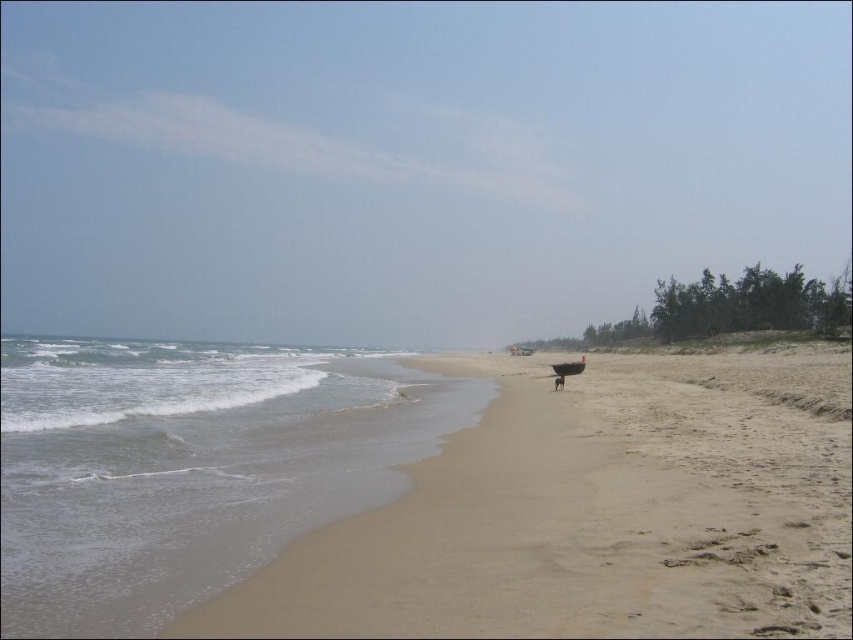
Consider the image. Can you confirm if light beige sand at lower left is smaller than gray sand at lower left?

Correct, light beige sand at lower left occupies less space than gray sand at lower left.

Measure the distance between point (779, 580) and camera.

Point (779, 580) is 6.51 meters away from camera.

Between point (497, 412) and point (189, 560), which one is positioned behind?

Positioned behind is point (497, 412).

I want to click on light beige sand at lower left, so click(x=593, y=513).